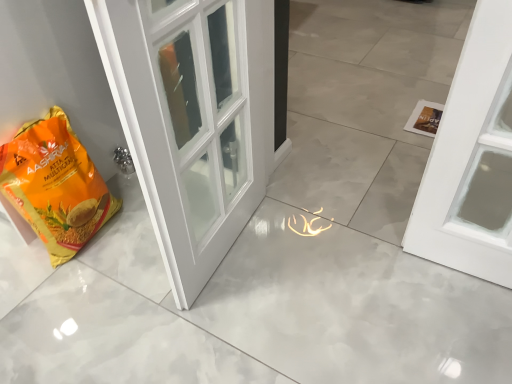
You are a GUI agent. You are given a task and a screenshot of the screen. Output one action in this format:
    pyautogui.click(x=<x>, y=<y>)
    Task: Click on the orange matte bag of aashirvaad atta multigrain at lower left
    
    Given the screenshot: What is the action you would take?
    pyautogui.click(x=55, y=185)

Image resolution: width=512 pixels, height=384 pixels. Describe the element at coordinates (55, 185) in the screenshot. I see `orange matte bag of aashirvaad atta multigrain at lower left` at that location.

The width and height of the screenshot is (512, 384). In order to click on orange matte bag of aashirvaad atta multigrain at lower left in this screenshot , I will do `click(55, 185)`.